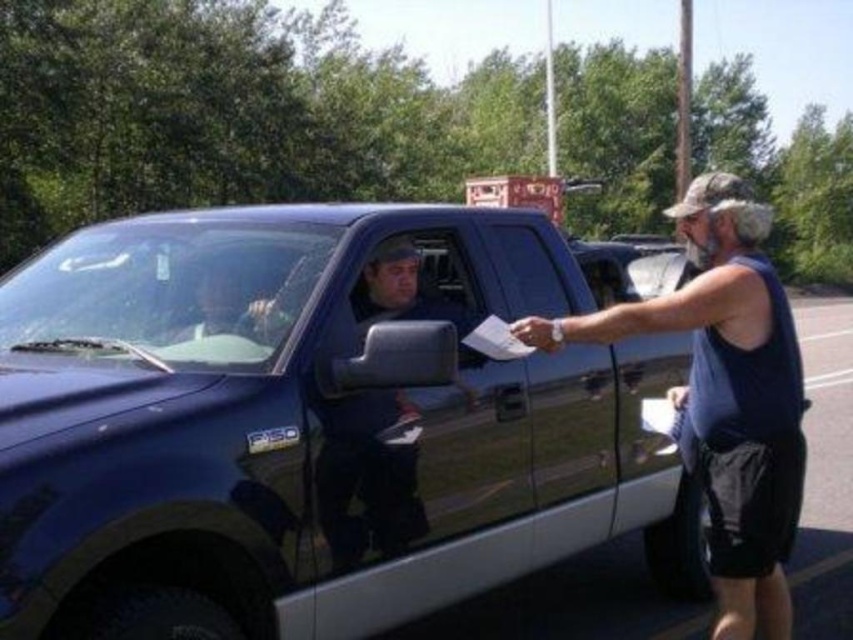
What are the coordinates of the glossy blue truck at center?

The glossy blue truck at center is located at coordinates point [310,428].

You are a delivery person who needs to place a package between the glossy blue truck at center and the glossy blue truck at right. Can you fit the package there if it measures 1 meter in length?

The distance between the glossy blue truck at center and the glossy blue truck at right is 90.87 centimeters, which is shorter than the package length of 1 meter. Therefore, the package cannot fit between them.

You are a delivery driver who needs to park your vehicle between the glossy blue truck at center and the glossy blue truck at right. Can you fit your 2.5 meter wide delivery van in the space between them?

The glossy blue truck at center might be wider than glossy blue truck at right, so the space between them is uncertain. You should measure the distance before deciding to park your 2.5 meter wide delivery van there.